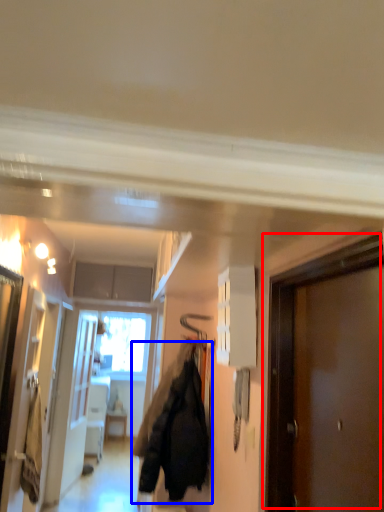
Question: Among these objects, which one is nearest to the camera, door (highlighted by a red box) or jacket (highlighted by a blue box)?

Choices:
 (A) door
 (B) jacket

Answer: (A)